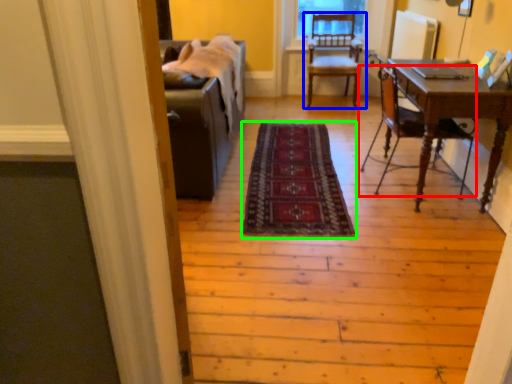
Question: Which object is positioned closest to chair (highlighted by a red box)? Select from chair (highlighted by a blue box) and mat (highlighted by a green box).

Choices:
 (A) chair
 (B) mat

Answer: (B)